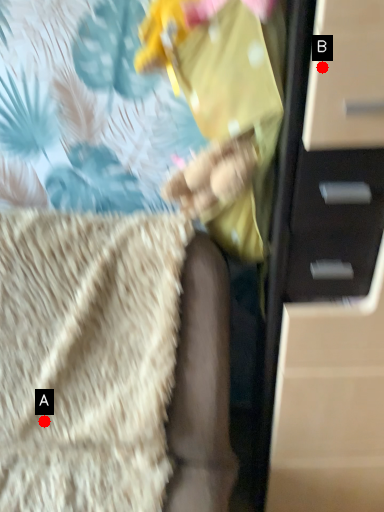
Question: Two points are circled on the image, labeled by A and B beside each circle. Which point appears farthest from the camera in this image?

Choices:
 (A) A is further
 (B) B is further

Answer: (A)